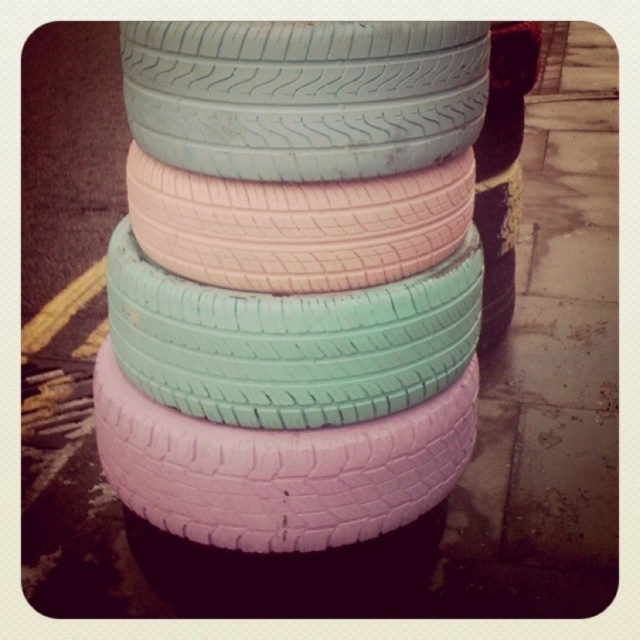
You are a delivery person trying to stack two more tires on top of the existing ones. Given that the light blue rubber tire at center is taller than the pink matte tire at center, which tire should you place the next tire on top of to ensure stability?

You should place the next tire on top of the pink matte tire at center because the light blue rubber tire at center is taller, making the pink matte tire at center a more stable base for additional stacking.

In the scene shown: You are trying to fit a new tire into the existing stack shown in the scene. The new tire has the same color as the light blue rubber tire at center. Will the new tire fit into the stack if placed on top of the pastel matte tires at center?

The pastel matte tires at center are wider than the light blue rubber tire at center. Since the new tire matches the light blue rubber tire at center in color, it likely shares its dimensions. Therefore, placing it on top of the wider pastel matte tires at center would be possible as the new tire is narrower and would fit within the base width.

You are a delivery person who needs to place a new tire that is the same size as the light blue rubber tire at center into a storage box that can only fit items smaller than the pastel matte tires at center. Will the new tire fit in the box?

The pastel matte tires at center is bigger than the light blue rubber tire at center. Since the storage box can only fit items smaller than the pastel matte tires at center, the new tire, which is the same size as the light blue rubber tire at center, will fit in the box because it is smaller than the pastel matte tires at center.